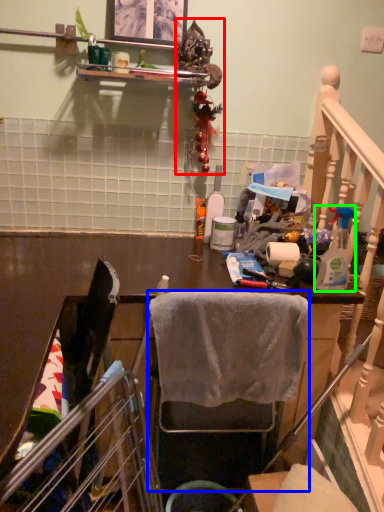
Question: Which object is positioned farthest from christmas decoration (highlighted by a red box)? Select from chair (highlighted by a blue box) and bottle (highlighted by a green box).

Choices:
 (A) chair
 (B) bottle

Answer: (A)